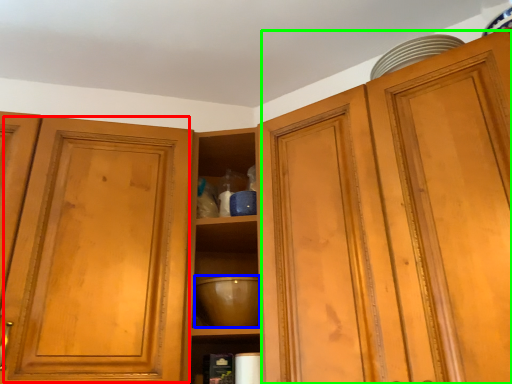
Question: Which is farther away from glass door (highlighted by a red box)? mixing bowl (highlighted by a blue box) or cabinetry (highlighted by a green box)?

Choices:
 (A) mixing bowl
 (B) cabinetry

Answer: (B)